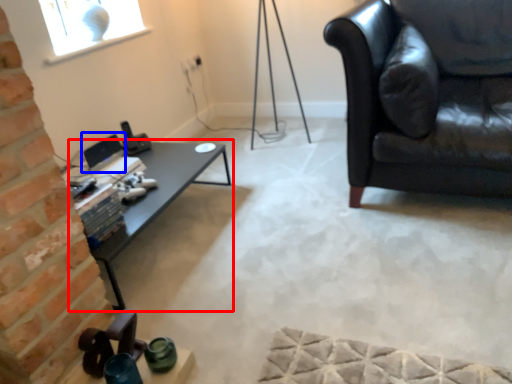
Question: Which of the following is the closest to the observer, table (highlighted by a red box) or computer monitor (highlighted by a blue box)?

Choices:
 (A) table
 (B) computer monitor

Answer: (A)